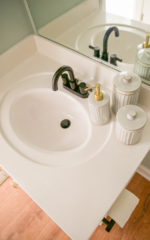
I want to click on faucet, so click(x=55, y=75).